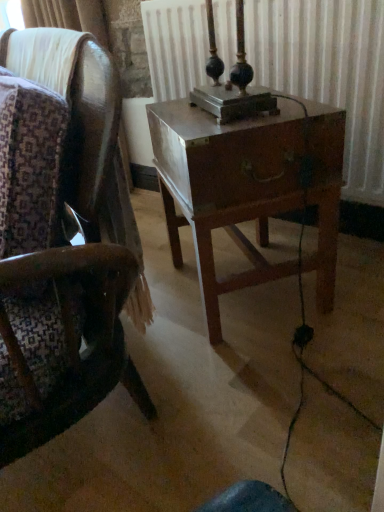
What do you see at coordinates (61, 239) in the screenshot? The width and height of the screenshot is (384, 512). I see `wooden chair at center` at bounding box center [61, 239].

Identify the location of wooden nightstand at center. Image resolution: width=384 pixels, height=512 pixels. (248, 188).

Where is `metallic radiator at center`? The height and width of the screenshot is (512, 384). metallic radiator at center is located at coordinates (328, 72).

Does wooden chair at center touch metallic radiator at center?

No, wooden chair at center is not next to metallic radiator at center.

In terms of size, does wooden chair at center appear bigger or smaller than metallic radiator at center?

wooden chair at center is bigger than metallic radiator at center.

From a real-world perspective, between wooden chair at center and metallic radiator at center, who is vertically lower?

In real-world perspective, wooden chair at center is lower.

From the image's perspective, is wooden chair at center located above metallic radiator at center?

No, from the image's perspective, wooden chair at center is not on top of metallic radiator at center.

From a real-world perspective, does wooden chair at center sit lower than wooden nightstand at center?

No, from a real-world perspective, wooden chair at center is not under wooden nightstand at center.

Is wooden chair at center not near wooden nightstand at center?

No, wooden chair at center is in close proximity to wooden nightstand at center.

Considering the relative sizes of wooden chair at center and wooden nightstand at center in the image provided, is wooden chair at center bigger than wooden nightstand at center?

Yes.

Is metallic radiator at center not near wooden nightstand at center?

That's not correct — metallic radiator at center is a little close to wooden nightstand at center.

Is metallic radiator at center inside or outside of wooden nightstand at center?

The correct answer is: outside.

Is point (204, 36) closer to viewer compared to point (180, 140)?

No.

The image size is (384, 512). What are the coordinates of `radiator on the right of wooden nightstand at center` in the screenshot? It's located at (328, 72).

Is metallic radiator at center behind wooden chair at center?

Yes, metallic radiator at center is further from the viewer.

Considering the positions of points (227, 36) and (16, 88), is point (227, 36) closer to camera compared to point (16, 88)?

No, it is behind (16, 88).

From the image's perspective, who appears lower, metallic radiator at center or wooden chair at center?

wooden chair at center.

Is wooden chair at center completely or partially inside metallic radiator at center?

That's incorrect, wooden chair at center is not inside metallic radiator at center.

How different are the orientations of wooden nightstand at center and wooden chair at center in degrees?

The angular difference between wooden nightstand at center and wooden chair at center is 7.97 degrees.

Does point (254, 121) appear closer or farther from the camera than point (30, 419)?

Clearly, point (254, 121) is more distant from the camera than point (30, 419).

From the image's perspective, which one is positioned higher, wooden nightstand at center or wooden chair at center?

From the image's view, wooden chair at center is above.

Do you think wooden nightstand at center is within wooden chair at center, or outside of it?

wooden nightstand at center is not inside wooden chair at center, it's outside.

From the picture: Can metallic radiator at center be found inside wooden nightstand at center?

That's incorrect, metallic radiator at center is not inside wooden nightstand at center.

Between wooden nightstand at center and metallic radiator at center, which one has smaller width?

Thinner between the two is metallic radiator at center.

Can you confirm if wooden nightstand at center is taller than metallic radiator at center?

Correct, wooden nightstand at center is much taller as metallic radiator at center.

How distant is wooden nightstand at center from metallic radiator at center?

They are 16.96 inches apart.

In order to click on chair lying on the left of metallic radiator at center in this screenshot , I will do `click(61, 239)`.

The image size is (384, 512). In order to click on chair above the wooden nightstand at center (from a real-world perspective) in this screenshot , I will do `click(61, 239)`.

Estimate the real-world distances between objects in this image. Which object is further from wooden chair at center, wooden nightstand at center or metallic radiator at center?

The object further to wooden chair at center is metallic radiator at center.

Considering their positions, is metallic radiator at center positioned further to wooden chair at center than wooden nightstand at center?

metallic radiator at center is further to wooden chair at center.

Considering their positions, is wooden nightstand at center positioned closer to metallic radiator at center than wooden chair at center?

wooden nightstand at center.

Based on their spatial positions, is wooden chair at center or wooden nightstand at center closer to metallic radiator at center?

The object closer to metallic radiator at center is wooden nightstand at center.

Based on their spatial positions, is metallic radiator at center or wooden chair at center closer to wooden nightstand at center?

wooden chair at center is positioned closer to the anchor wooden nightstand at center.

Based on their spatial positions, is wooden chair at center or metallic radiator at center closer to wooden nightstand at center?

Based on the image, wooden chair at center appears to be nearer to wooden nightstand at center.

Where is `nightstand between wooden chair at center and metallic radiator at center in the horizontal direction`? nightstand between wooden chair at center and metallic radiator at center in the horizontal direction is located at coordinates (248, 188).